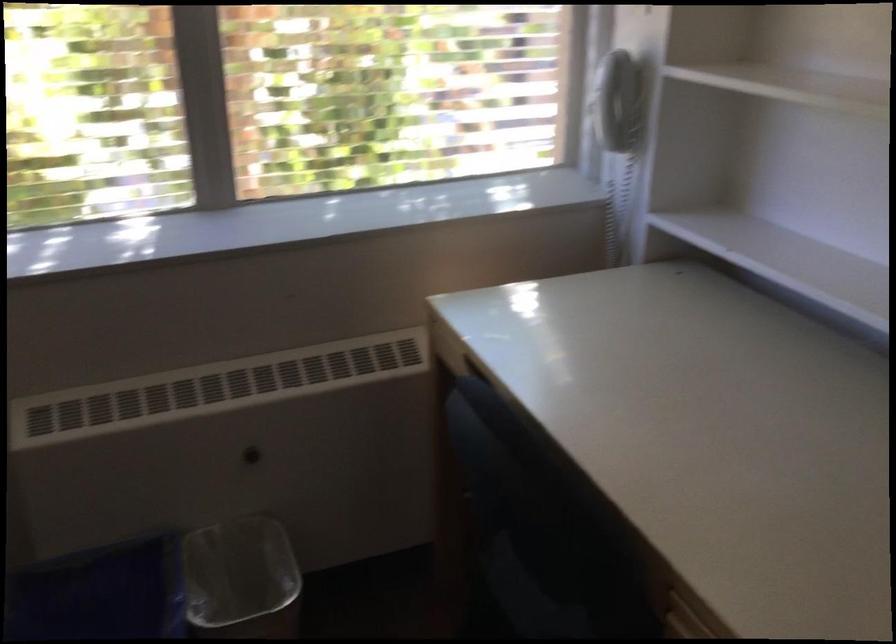
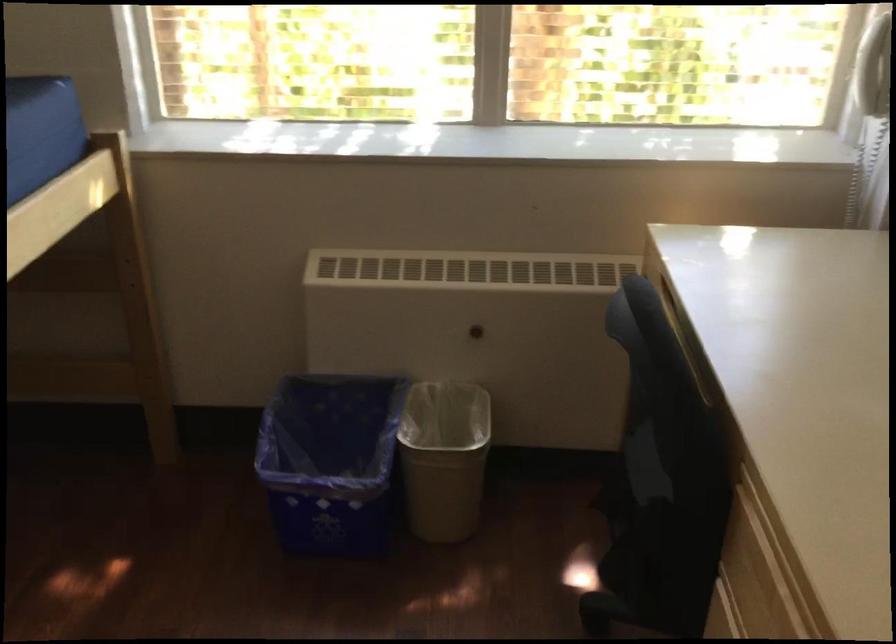
The point at (x=609, y=108) is marked in the first image. Where is the corresponding point in the second image?

(874, 69)